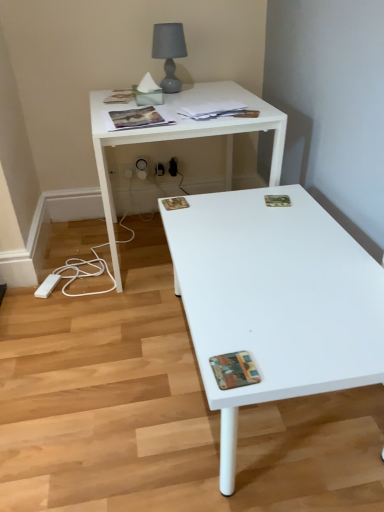
Image resolution: width=384 pixels, height=512 pixels. In order to click on free space above matte paper magazine at upper left, marked as the sixth magazine in a front-to-back arrangement (from a real-world perspective) in this screenshot , I will do `click(119, 93)`.